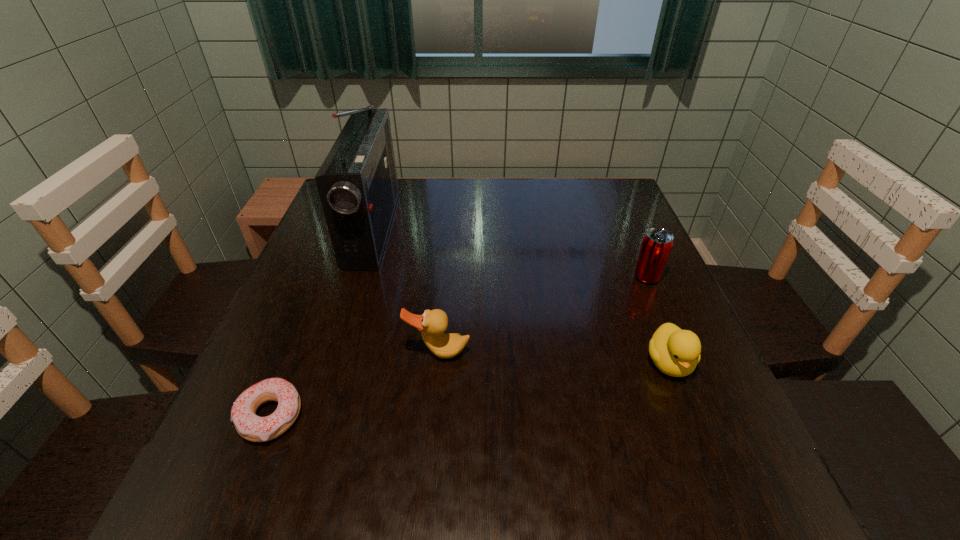
The image size is (960, 540). I want to click on vacant area that lies between the radio receiver and the soda can, so click(510, 253).

At what (x,y) coordinates should I click in order to perform the action: click on object that is the third closest to the doughnut. Please return your answer as a coordinate pair (x, y). Looking at the image, I should click on (676, 352).

Identify which object is located as the nearest to the shortest object. Please provide its 2D coordinates. Your answer should be formatted as a tuple, i.e. [(x, y)], where the tuple contains the x and y coordinates of a point satisfying the conditions above.

[(432, 323)]